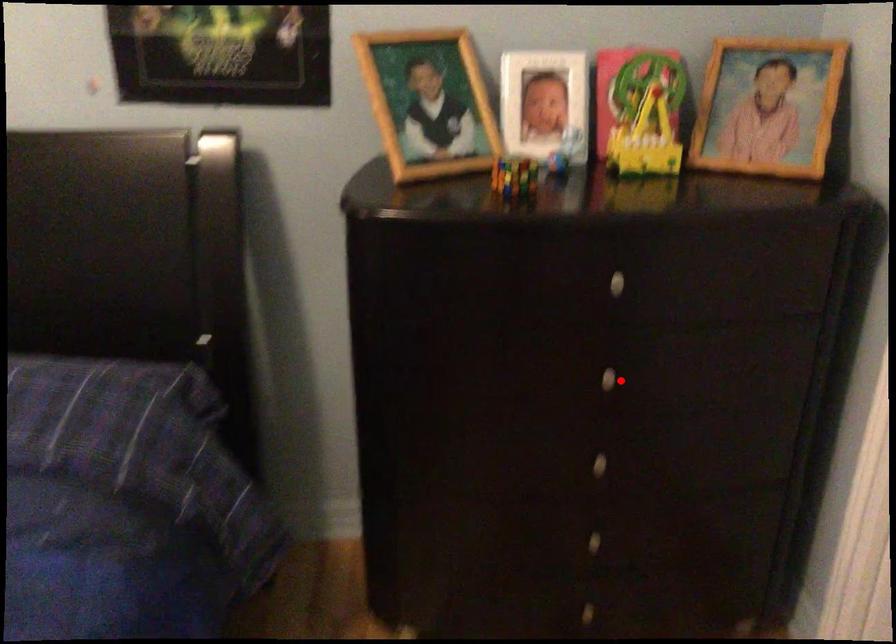
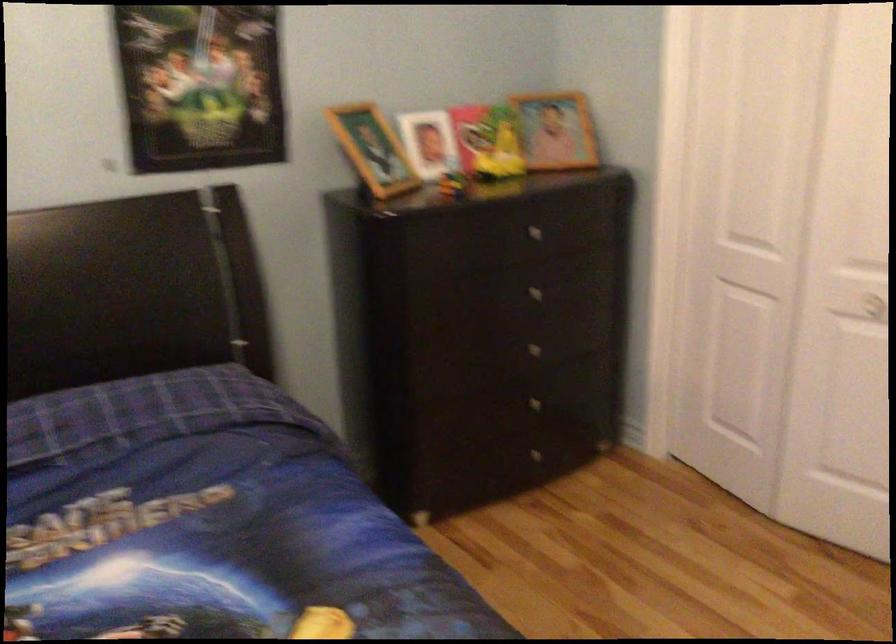
Locate, in the second image, the point that corresponds to the highlighted location in the first image.

(538, 292)